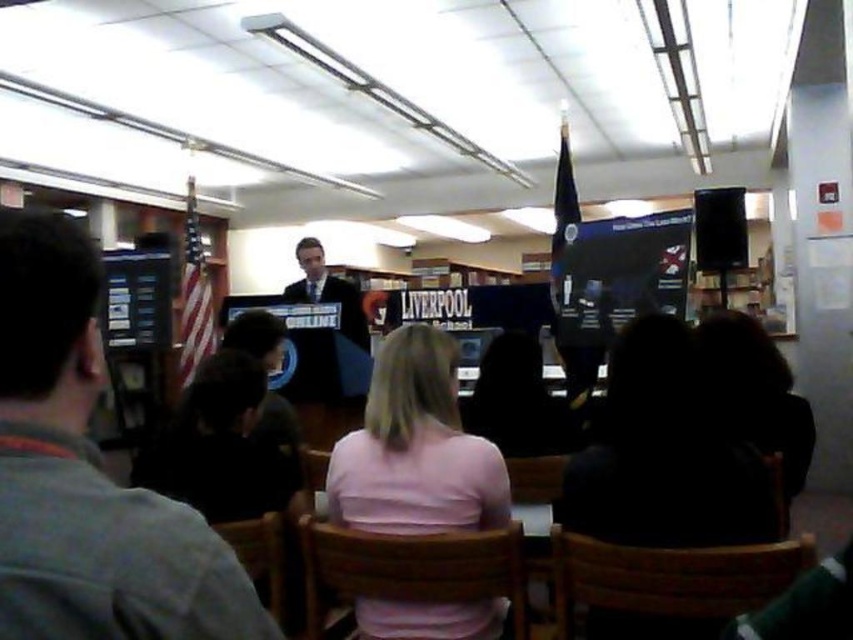
You are standing at the front of the room and want to place a small decoration between the two points labeled point (590,588) and point (347,566). Which point should the decoration be closer to in order to be nearer to the speaker?

The decoration should be closer to point (590,588) because it is nearer to the speaker than point (347,566).